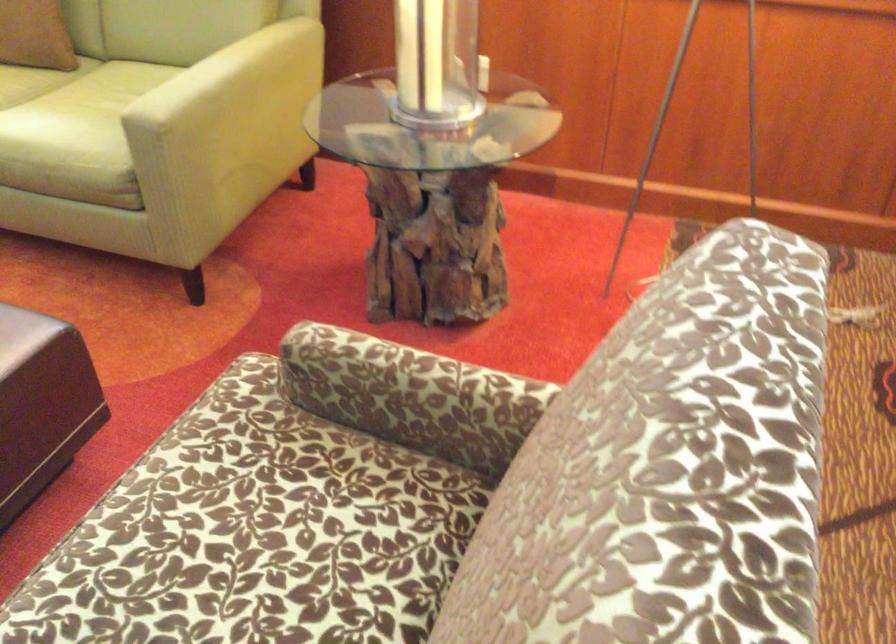
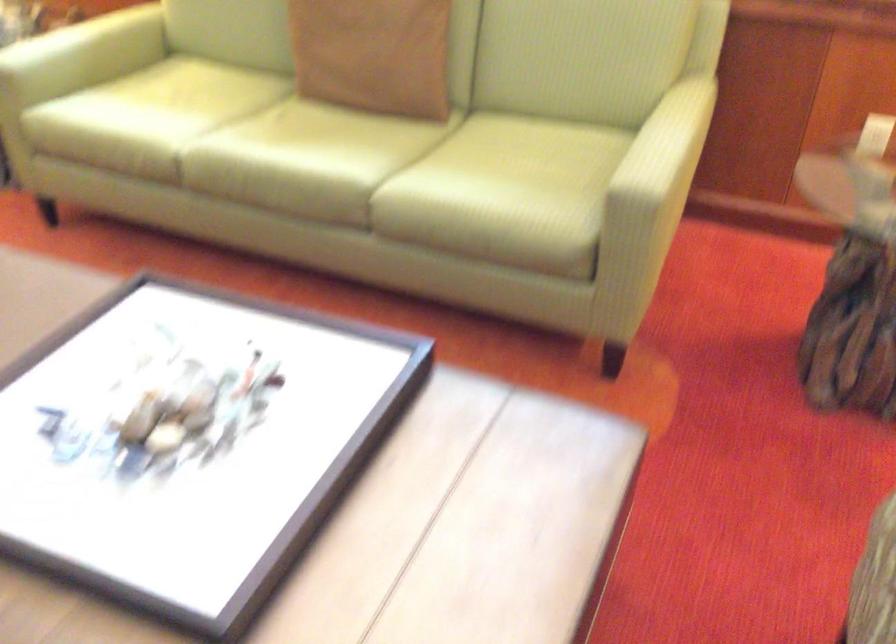
Find the pixel in the second image that matches point 195,71 in the first image.

(668, 142)